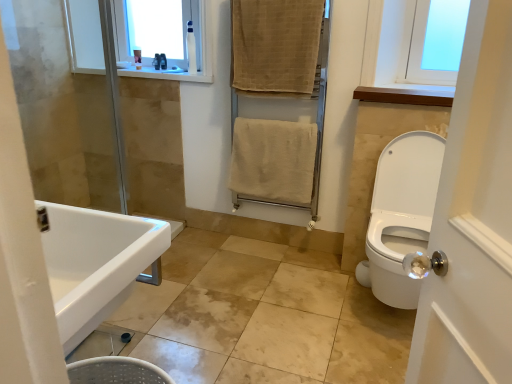
Question: From a real-world perspective, is clear plastic bottle at upper center, which is the 3th toiletry from right to left, positioned above or below beige textured towel rack at center?

Choices:
 (A) above
 (B) below

Answer: (A)

Question: From the image's perspective, is clear plastic bottle at upper center, the first toiletry in the left-to-right sequence, positioned above or below beige textured towel rack at center?

Choices:
 (A) above
 (B) below

Answer: (A)

Question: Which is farther from the clear plastic bottle at upper center, which is the 3th toiletry from right to left?

Choices:
 (A) white glossy sink at lower left
 (B) translucent plastic soap dispenser at upper left, the second toiletry when ordered from left to right
 (C) beige textured towel at upper center, which appears as the first bath towel when viewed from the top
 (D) beige cotton towel at center, positioned as the first bath towel in bottom-to-top order
 (E) white plastic bottle at upper center, which appears as the third toiletry when viewed from the left

Answer: (A)

Question: Which of these objects is positioned closest to the transparent plastic bottle at upper center?

Choices:
 (A) beige textured towel at upper center, the second bath towel in the bottom-to-top sequence
 (B) beige textured towel rack at center
 (C) white plastic bottle at upper center, which appears as the third toiletry when viewed from the left
 (D) clear plastic bottle at upper center, which is the 3th toiletry from right to left
 (E) translucent plastic soap dispenser at upper left, the 1th toiletry when ordered from back to front

Answer: (D)